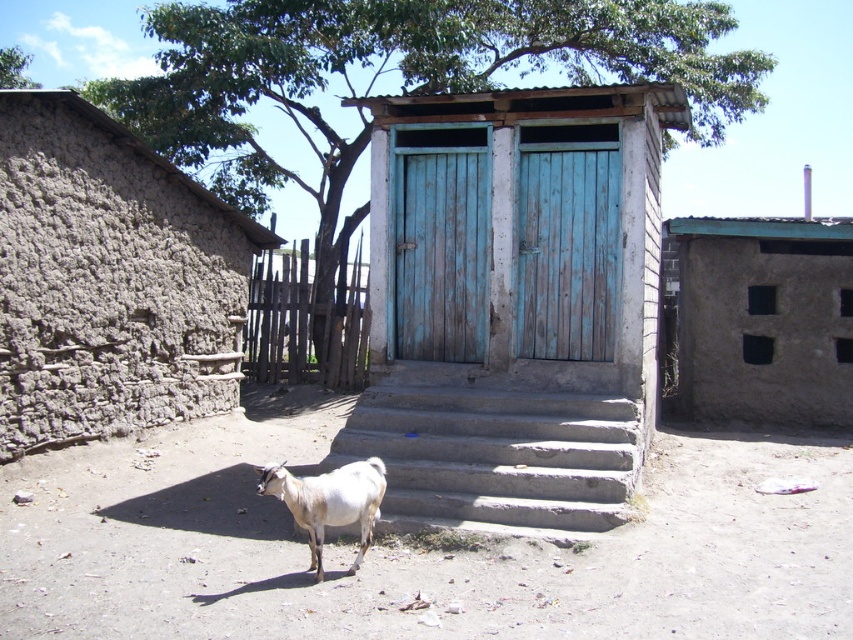
Question: Among these objects, which one is nearest to the camera?

Choices:
 (A) green leafy tree at upper left
 (B) weathered teal wood door at center
 (C) white woolen goat at lower center
 (D) concrete stairs at center

Answer: (C)

Question: Can you confirm if blue weathered wood door at center is bigger than white woolen goat at lower center?

Choices:
 (A) no
 (B) yes

Answer: (B)

Question: Considering the real-world distances, which object is farthest from the green leafy tree at upper left?

Choices:
 (A) weathered teal wood door at center
 (B) blue weathered wood door at center
 (C) concrete stairs at center
 (D) white woolen goat at lower center

Answer: (D)

Question: Which object appears closest to the camera in this image?

Choices:
 (A) white woolen goat at lower center
 (B) weathered teal wood door at center
 (C) brown mud hut at upper right
 (D) concrete stairs at center

Answer: (A)

Question: In this image, where is brown mud hut at upper right located relative to weathered teal wood door at center?

Choices:
 (A) right
 (B) left

Answer: (A)

Question: Does clay mud wall at left appear over weathered teal wood door at center?

Choices:
 (A) no
 (B) yes

Answer: (A)